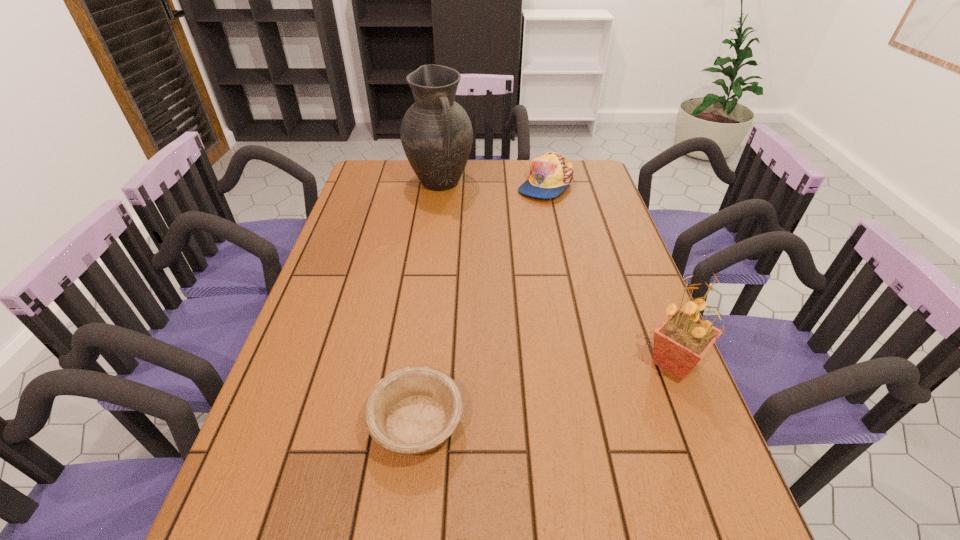
Image resolution: width=960 pixels, height=540 pixels. In order to click on cap present at the right edge in this screenshot , I will do `click(551, 173)`.

Identify the location of object present at the far right corner. (551, 173).

Locate an element on the screen. The image size is (960, 540). vacant space at the far edge of the desktop is located at coordinates (496, 191).

In the image, there is a desktop. Identify the location of vacant space at the near edge. (385, 499).

At what (x,y) coordinates should I click in order to perform the action: click on free space at the left edge. Please return your answer as a coordinate pair (x, y). This screenshot has height=540, width=960. Looking at the image, I should click on (361, 231).

The width and height of the screenshot is (960, 540). Find the location of `free space at the right edge of the desktop`. free space at the right edge of the desktop is located at coordinates (626, 321).

Locate an element on the screen. This screenshot has height=540, width=960. free space at the near left corner is located at coordinates pyautogui.click(x=318, y=496).

Where is `vacant position at the far right corner of the desktop`? The height and width of the screenshot is (540, 960). vacant position at the far right corner of the desktop is located at coordinates (586, 189).

In the image, there is a desktop. Identify the location of free region at the near right corner. (667, 475).

I want to click on free space between the shortest object and the pitcher, so click(428, 303).